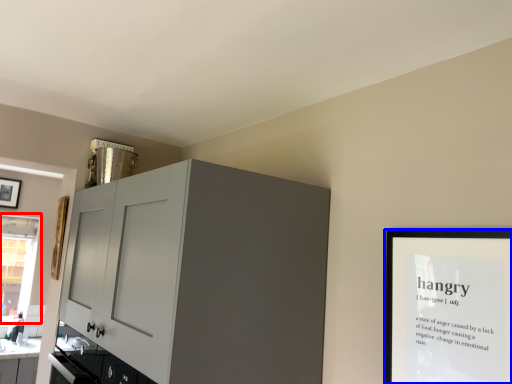
Question: Which point is further to the camera, window (highlighted by a red box) or picture frame (highlighted by a blue box)?

Choices:
 (A) window
 (B) picture frame

Answer: (A)